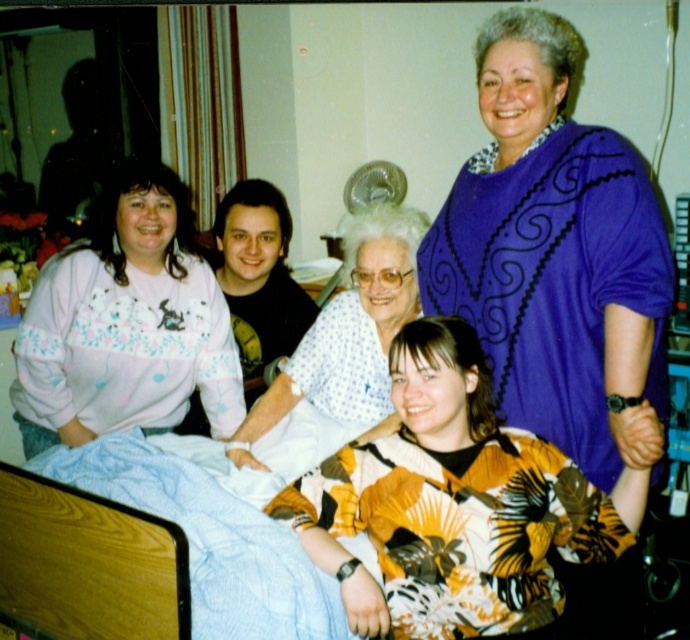
Does yellow floral shirt at center have a larger size compared to white dotted fabric at center?

No, yellow floral shirt at center is not bigger than white dotted fabric at center.

Is yellow floral shirt at center further to camera compared to white dotted fabric at center?

No, it is in front of white dotted fabric at center.

Between point (406, 509) and point (357, 356), which one is positioned in front?

Point (406, 509)

Where is `yellow floral shirt at center`? The image size is (690, 640). yellow floral shirt at center is located at coordinates (453, 504).

Is point (581, 406) behind point (305, 337)?

No, it is not.

In the scene shown: Can you confirm if purple swirled sweater at upper right is bigger than white dotted fabric at center?

A: Yes.

Who is more forward, (586, 144) or (408, 276)?

Positioned in front is point (586, 144).

Identify the location of purple swirled sweater at upper right. (555, 257).

Measure the distance between purple swirled sweater at upper right and yellow floral shirt at center.

purple swirled sweater at upper right is 10.72 inches from yellow floral shirt at center.

Which of these two, purple swirled sweater at upper right or yellow floral shirt at center, stands shorter?

Standing shorter between the two is yellow floral shirt at center.

Does point (629, 285) come closer to viewer compared to point (397, 570)?

Yes.

Where is `purple swirled sweater at upper right`? Image resolution: width=690 pixels, height=640 pixels. purple swirled sweater at upper right is located at coordinates (555, 257).